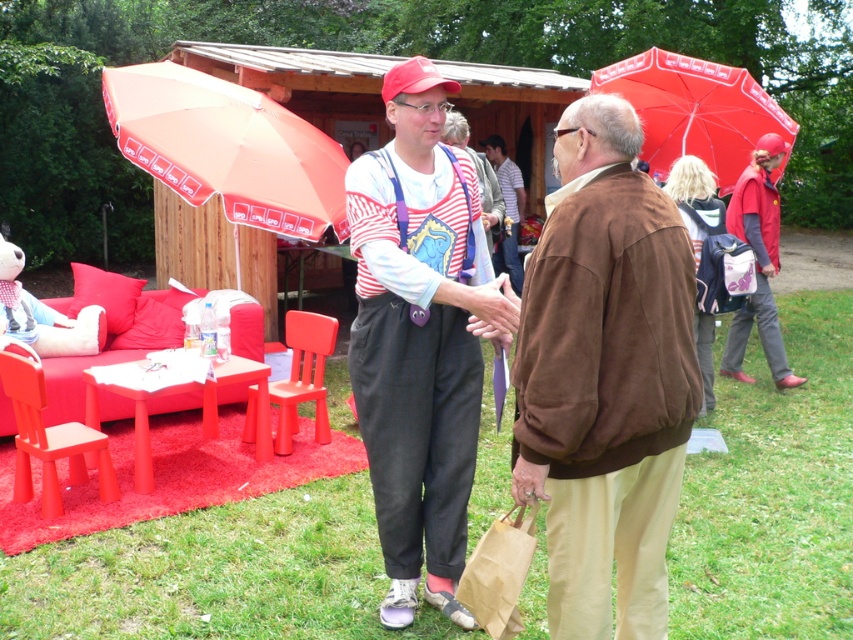
Question: Which object is positioned closest to the matte white t-shirt at center?

Choices:
 (A) red fabric jacket at right
 (B) matte plastic chair at center
 (C) striped fabric shirt at center

Answer: (B)

Question: Which point is farther to the camera?

Choices:
 (A) matte plastic chair at center
 (B) red fabric jacket at right
 (C) matte white shirt at center

Answer: (C)

Question: Can you confirm if matte plastic chair at lower left is positioned to the left of striped fabric shirt at center?

Choices:
 (A) yes
 (B) no

Answer: (A)

Question: Does red fabric umbrella at upper right come in front of red fabric jacket at right?

Choices:
 (A) no
 (B) yes

Answer: (A)

Question: Does red fabric umbrella at upper right have a greater width compared to red fabric jacket at right?

Choices:
 (A) yes
 (B) no

Answer: (A)

Question: Among these objects, which one is nearest to the camera?

Choices:
 (A) matte plastic chair at center
 (B) brown suede jacket at center
 (C) red fabric jacket at right
 (D) matte white t-shirt at center

Answer: (B)